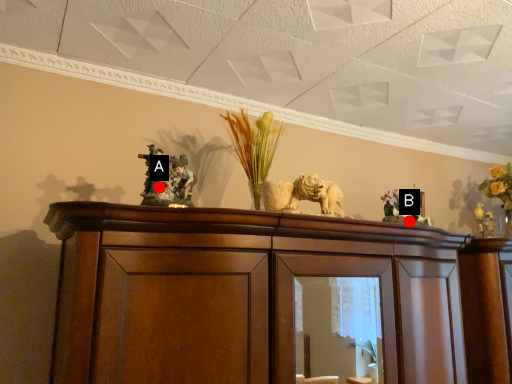
Question: Two points are circled on the image, labeled by A and B beside each circle. Which point appears farthest from the camera in this image?

Choices:
 (A) A is further
 (B) B is further

Answer: (B)